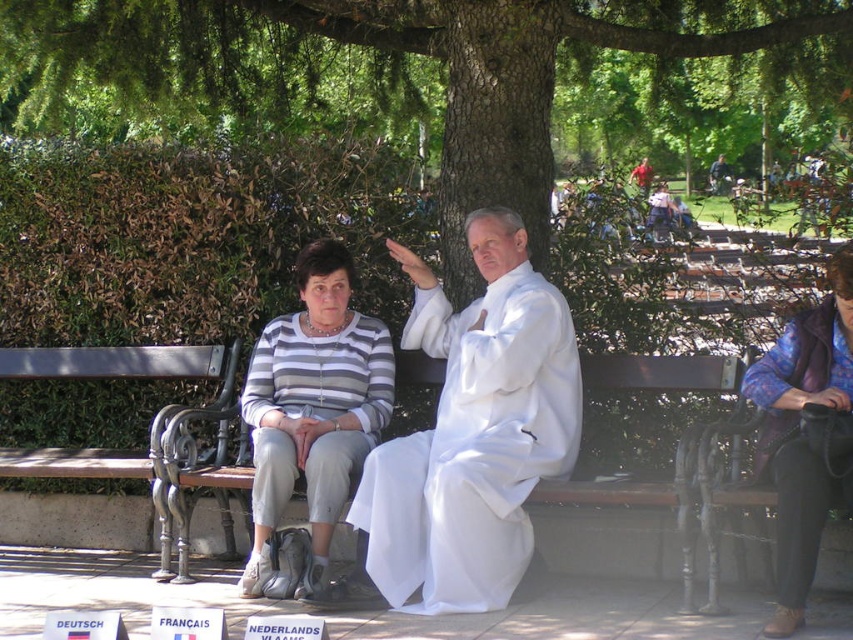
Can you confirm if green leafy tree at center is positioned above brown wooden bench at left?

Yes.

Identify the location of green leafy tree at center. (396, 58).

The image size is (853, 640). In order to click on green leafy tree at center in this screenshot , I will do `click(396, 58)`.

Between green leafy tree at center and white cloth at center, which one is positioned higher?

green leafy tree at center is higher up.

Looking at this image, can you confirm if green leafy tree at center is thinner than white cloth at center?

In fact, green leafy tree at center might be wider than white cloth at center.

Between point (129, 36) and point (460, 365), which one is positioned behind?

Positioned behind is point (129, 36).

At what (x,y) coordinates should I click in order to perform the action: click on green leafy tree at center. Please return your answer as a coordinate pair (x, y). This screenshot has height=640, width=853. Looking at the image, I should click on (396, 58).

Does striped knit sweater at center lie in front of brown wooden bench at center?

Yes.

Can you confirm if striped knit sweater at center is positioned below brown wooden bench at center?

No, striped knit sweater at center is not below brown wooden bench at center.

Is point (300, 424) positioned in front of point (178, 548)?

Yes, it is.

Identify the location of striped knit sweater at center. This screenshot has width=853, height=640. (312, 406).